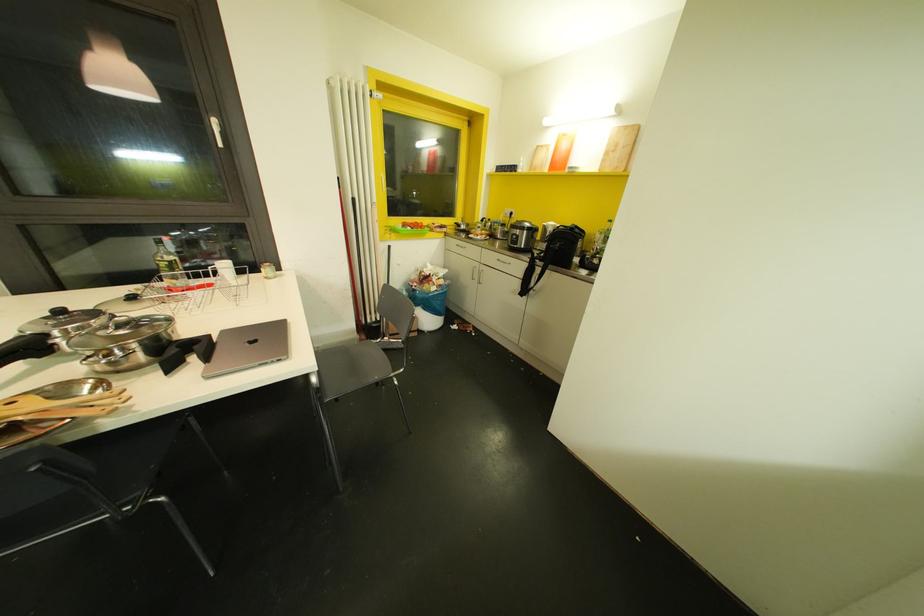
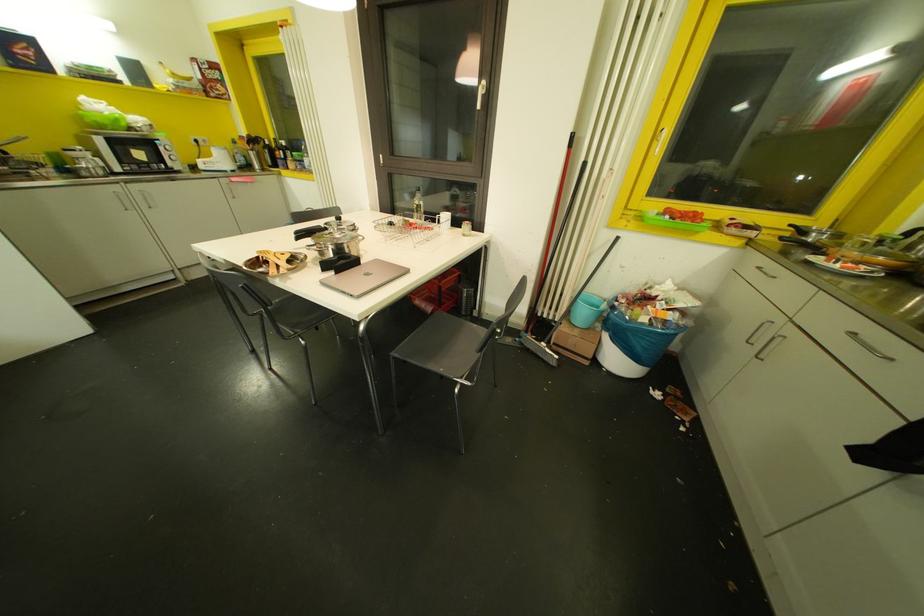
First-person continuous shooting, in which direction is the camera rotating?

The camera rotated toward left-down.